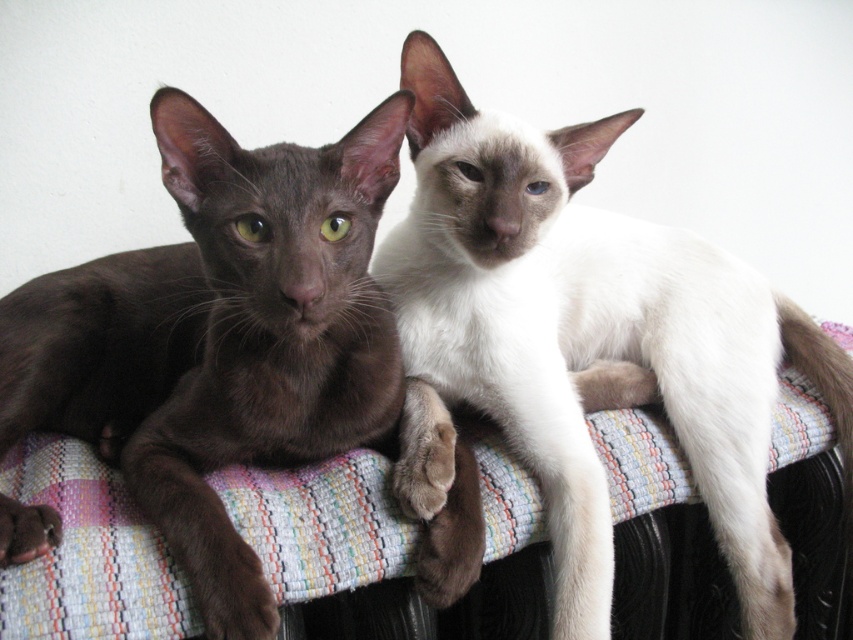
Question: In this image, where is white silky fur cat at center located relative to shiny brown cat at left?

Choices:
 (A) right
 (B) left

Answer: (A)

Question: Among these objects, which one is nearest to the camera?

Choices:
 (A) shiny brown cat at left
 (B) white silky fur cat at center

Answer: (A)

Question: Which of the following is the closest to the observer?

Choices:
 (A) shiny brown cat at left
 (B) white silky fur cat at center

Answer: (A)

Question: Is white silky fur cat at center smaller than shiny brown cat at left?

Choices:
 (A) no
 (B) yes

Answer: (A)

Question: Does white silky fur cat at center appear over shiny brown cat at left?

Choices:
 (A) yes
 (B) no

Answer: (B)